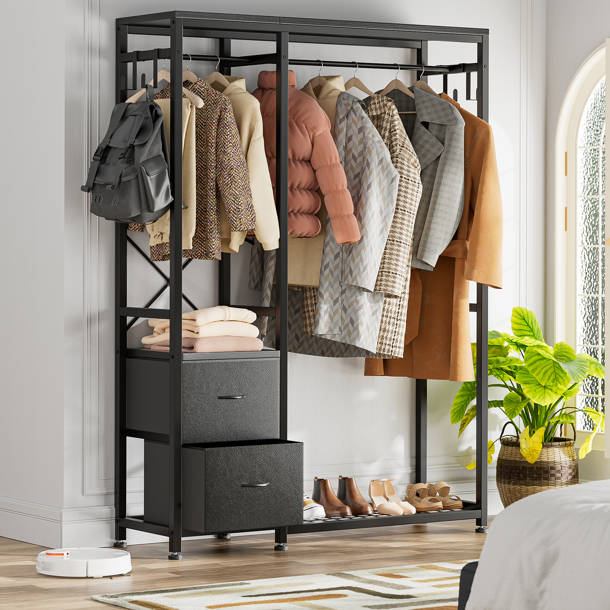
Locate an element on the screen. hangers is located at coordinates (422, 74), (396, 87), (357, 85), (321, 77), (214, 74), (188, 77), (190, 95).